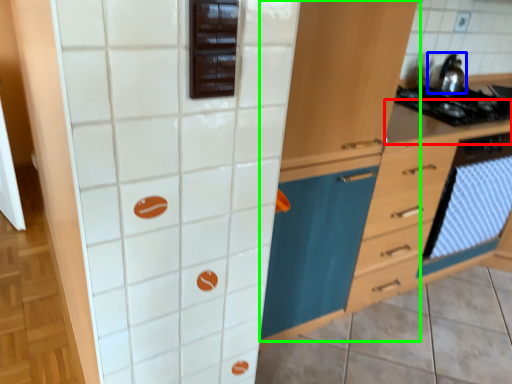
Question: Estimate the real-world distances between objects in this image. Which object is farther from counter top (highlighted by a red box), kitchen appliance (highlighted by a blue box) or cabinetry (highlighted by a green box)?

Choices:
 (A) kitchen appliance
 (B) cabinetry

Answer: (B)